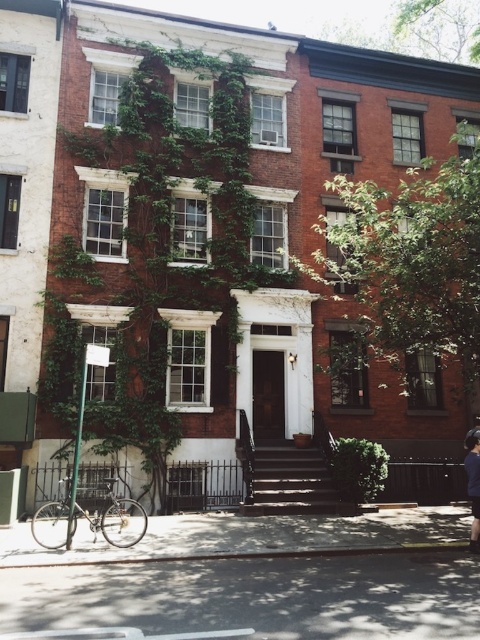
You are standing in front of the building and notice two points marked on the facade. The first point is at coordinate (241, 280) and the second at (476, 474). Which point is closer to you?

Point (241, 280) is further to the camera than point (476, 474). Therefore, point (476, 474) is closer to you.

You are a painter who needs to cover the green ivy at center and the dark brown wooden stairs at center with paint. If the ivy requires 2 liters of paint per square meter, and the stairs require 1.5 liters per square meter, which object will require more paint considering their widths?

The dark brown wooden stairs at center will require more paint because its width is greater than the green ivy at center, and even though the stairs have a lower paint consumption rate per square meter, the increased width compensates for the difference.